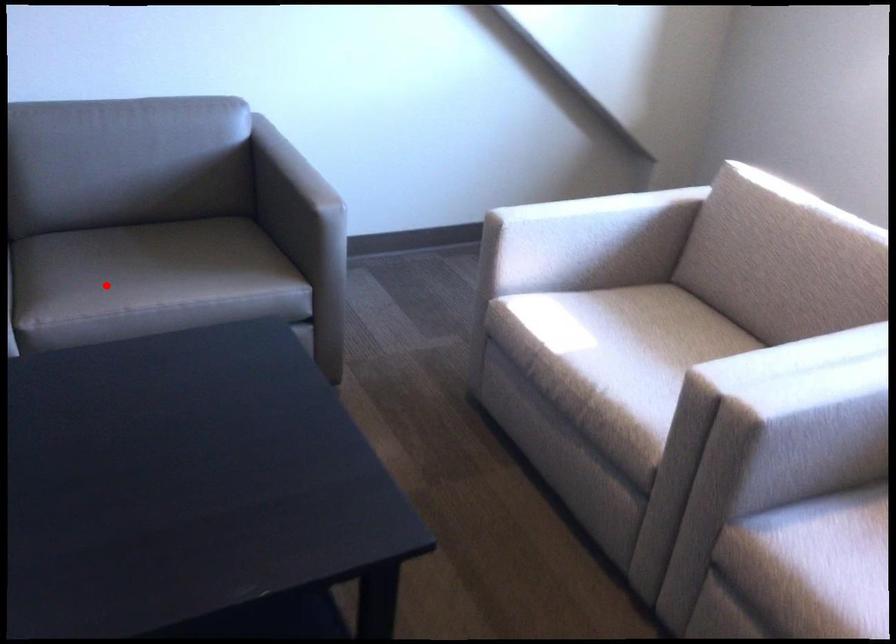
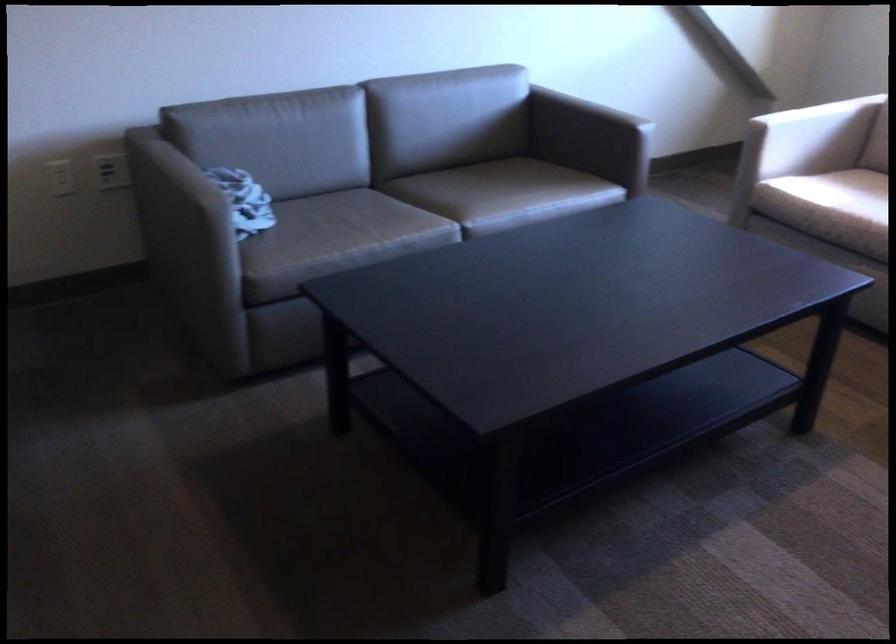
The point at the highlighted location is marked in the first image. Where is the corresponding point in the second image?

(489, 194)